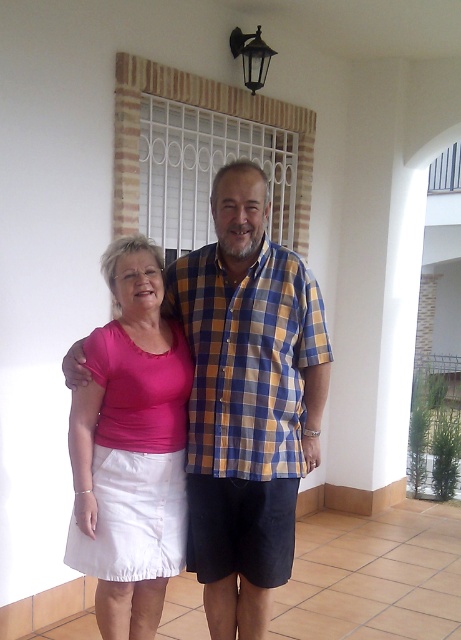
You are a fashion designer observing the image and want to create a new outfit using the pink cotton shirt at center and the pink fabric skirt at lower left. Which item should you place on top when layering them?

The pink cotton shirt at center should be placed on top since it is positioned over the pink fabric skirt at lower left in the image.

You are trying to find the pink cotton shirt at center in a room. Where would you look relative to the pink fabric skirt at lower left?

The pink cotton shirt at center is located to the right of the pink fabric skirt at lower left.